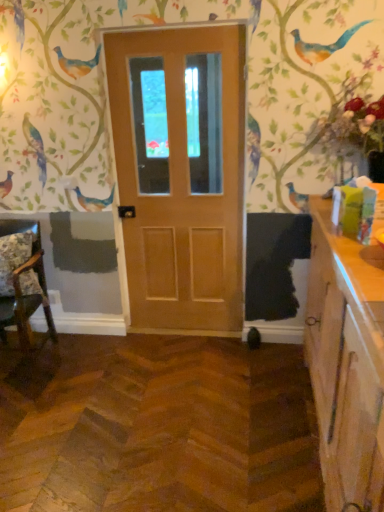
Question: From the image's perspective, is wooden cabinet at right above or below matte wood door at center?

Choices:
 (A) above
 (B) below

Answer: (B)

Question: Is wooden cabinet at right to the left or to the right of matte wood door at center in the image?

Choices:
 (A) left
 (B) right

Answer: (B)

Question: Which object is positioned closest to the fluffy floral pillow at left?

Choices:
 (A) matte wood door at center
 (B) wooden cabinet at right
 (C) wooden floral-patterned chair at left

Answer: (C)

Question: Based on their relative distances, which object is farther from the wooden floral-patterned chair at left?

Choices:
 (A) matte wood door at center
 (B) wooden cabinet at right
 (C) fluffy floral pillow at left

Answer: (B)